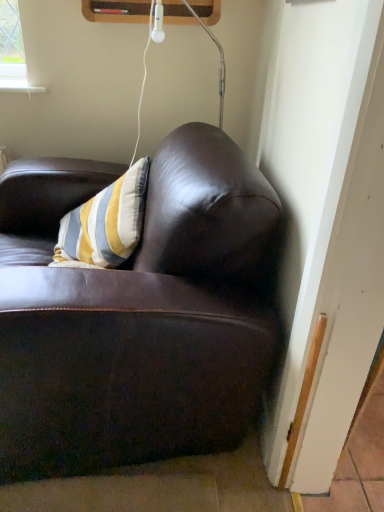
What is the approximate width of shiny brown leather couch at upper right?

1.01 meters.

Measure the distance between shiny brown leather couch at upper right and camera.

The depth of shiny brown leather couch at upper right is 93.06 centimeters.

Image resolution: width=384 pixels, height=512 pixels. What do you see at coordinates (136, 313) in the screenshot?
I see `shiny brown leather couch at upper right` at bounding box center [136, 313].

You are a GUI agent. You are given a task and a screenshot of the screen. Output one action in this format:
    pyautogui.click(x=<x>, y=<y>)
    Task: Click on the shiny brown leather couch at upper right
    
    Given the screenshot: What is the action you would take?
    pyautogui.click(x=136, y=313)

What is the approximate height of shiny brown leather couch at upper right?

The height of shiny brown leather couch at upper right is 34.05 inches.

I want to click on matte white lamp at upper center, so click(146, 53).

This screenshot has height=512, width=384. Describe the element at coordinates (146, 53) in the screenshot. I see `matte white lamp at upper center` at that location.

Locate an element on the screen. shiny brown leather couch at upper right is located at coordinates coord(136,313).

Considering the positions of objects shiny brown leather couch at upper right and matte white lamp at upper center in the image provided, who is more to the left, shiny brown leather couch at upper right or matte white lamp at upper center?

shiny brown leather couch at upper right is more to the left.

Which object is closer to the camera taking this photo, shiny brown leather couch at upper right or matte white lamp at upper center?

shiny brown leather couch at upper right is in front.

Between point (60, 159) and point (151, 24), which one is positioned in front?

The point (151, 24) is in front.

From the image's perspective, is shiny brown leather couch at upper right below matte white lamp at upper center?

Yes, from the image's perspective, shiny brown leather couch at upper right is beneath matte white lamp at upper center.

From a real-world perspective, is shiny brown leather couch at upper right physically located above or below matte white lamp at upper center?

shiny brown leather couch at upper right is situated lower than matte white lamp at upper center in the real world.

Is shiny brown leather couch at upper right wider or thinner than matte white lamp at upper center?

Clearly, shiny brown leather couch at upper right has more width compared to matte white lamp at upper center.

Is shiny brown leather couch at upper right taller than matte white lamp at upper center?

Yes.

Between shiny brown leather couch at upper right and matte white lamp at upper center, which one has larger size?

With larger size is shiny brown leather couch at upper right.

Could matte white lamp at upper center be considered to be inside shiny brown leather couch at upper right?

Indeed, matte white lamp at upper center is located within shiny brown leather couch at upper right.

Is shiny brown leather couch at upper right far from matte white lamp at upper center?

Actually, shiny brown leather couch at upper right and matte white lamp at upper center are a little close together.

Could you tell me if shiny brown leather couch at upper right is facing matte white lamp at upper center?

No.

Find the location of `lamp on the right of shiny brown leather couch at upper right`. lamp on the right of shiny brown leather couch at upper right is located at coordinates (146, 53).

Based on the photo, visually, is matte white lamp at upper center positioned to the left or to the right of shiny brown leather couch at upper right?

Clearly, matte white lamp at upper center is on the right of shiny brown leather couch at upper right in the image.

Which object is closer to the camera, matte white lamp at upper center or shiny brown leather couch at upper right?

shiny brown leather couch at upper right is in front.

Which is behind, point (149, 22) or point (29, 238)?

The point (149, 22) is behind.

From the image's perspective, between matte white lamp at upper center and shiny brown leather couch at upper right, which one is located above?

matte white lamp at upper center, from the image's perspective.

From a real-world perspective, who is located lower, matte white lamp at upper center or shiny brown leather couch at upper right?

shiny brown leather couch at upper right.

Is matte white lamp at upper center thinner than shiny brown leather couch at upper right?

Indeed, matte white lamp at upper center has a lesser width compared to shiny brown leather couch at upper right.

Can you confirm if matte white lamp at upper center is taller than shiny brown leather couch at upper right?

In fact, matte white lamp at upper center may be shorter than shiny brown leather couch at upper right.

Considering the relative sizes of matte white lamp at upper center and shiny brown leather couch at upper right in the image provided, is matte white lamp at upper center smaller than shiny brown leather couch at upper right?

Correct, matte white lamp at upper center occupies less space than shiny brown leather couch at upper right.

Is matte white lamp at upper center positioned beyond the bounds of shiny brown leather couch at upper right?

No, matte white lamp at upper center is not outside of shiny brown leather couch at upper right.

Does matte white lamp at upper center touch shiny brown leather couch at upper right?

There is a gap between matte white lamp at upper center and shiny brown leather couch at upper right.

Could you tell me if matte white lamp at upper center is turned towards shiny brown leather couch at upper right?

No, matte white lamp at upper center is not aimed at shiny brown leather couch at upper right.

What's the angular difference between matte white lamp at upper center and shiny brown leather couch at upper right's facing directions?

The angle between the facing direction of matte white lamp at upper center and the facing direction of shiny brown leather couch at upper right is 8.02 degrees.

Measure the distance between matte white lamp at upper center and shiny brown leather couch at upper right.

The distance of matte white lamp at upper center from shiny brown leather couch at upper right is 36.73 inches.

Image resolution: width=384 pixels, height=512 pixels. In order to click on lamp behind the shiny brown leather couch at upper right in this screenshot , I will do `click(146, 53)`.

This screenshot has height=512, width=384. What are the coordinates of `studio couch on the left of matte white lamp at upper center` in the screenshot? It's located at (136, 313).

This screenshot has width=384, height=512. I want to click on lamp behind the shiny brown leather couch at upper right, so click(146, 53).